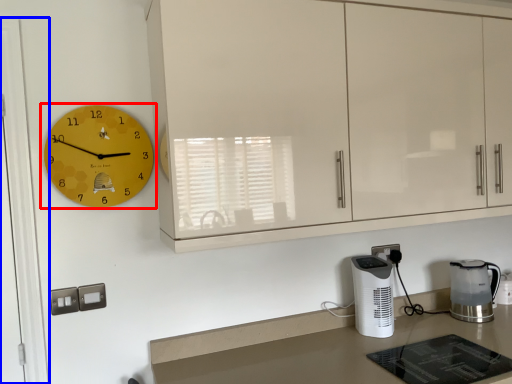
Question: Which object appears farthest to the camera in this image, wall clock (highlighted by a red box) or glass door (highlighted by a blue box)?

Choices:
 (A) wall clock
 (B) glass door

Answer: (A)